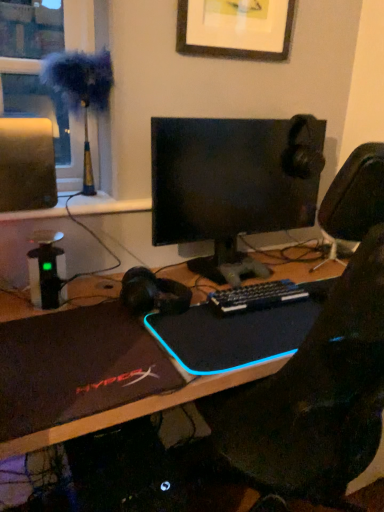
Locate an element on the screen. free space underneath black matte laptop at center, arranged as the first laptop when viewed from the right (from a real-world perspective) is located at coordinates (256, 325).